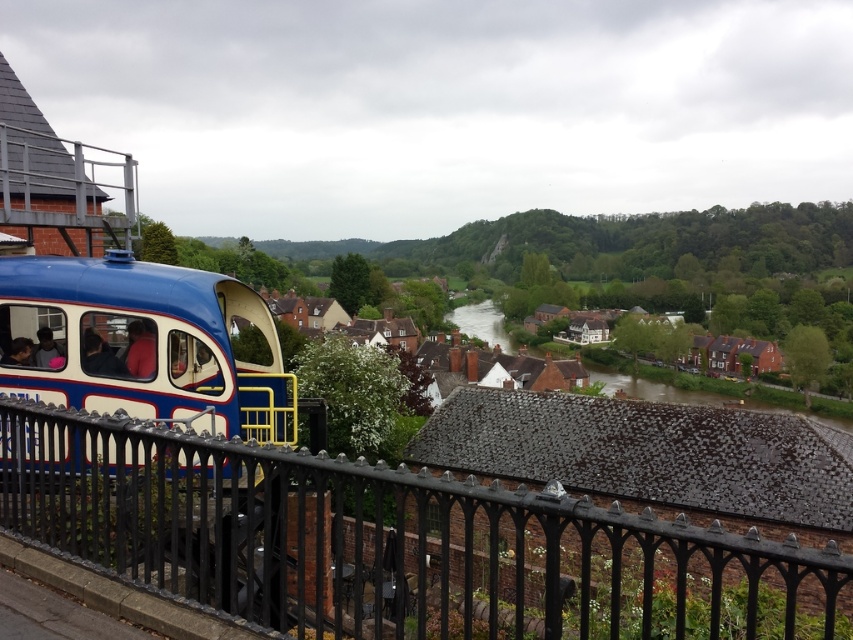
You are standing at the edge of a scenic overlook and see the black wrought iron fence at lower left and the clear water at center. Which object appears narrower from your perspective?

The black wrought iron fence at lower left appears narrower than the clear water at center.

Looking at this image, you are standing at the point marked by the coordinate point at (x=392, y=541), which is the black wrought iron fence at lower left. You want to walk towards the blue and cream train car to your left. Is the brick building with dark roof in the way?

The brick building with dark roof is between you and the blue and cream train car, so you cannot see the train car directly. You would need to go around the building to reach it.

You are standing at the center of the scene. Which direction should you walk to reach the matte blue train car at left?

Since the matte blue train car at left is located at point (141, 342), you should walk to the left to reach it.